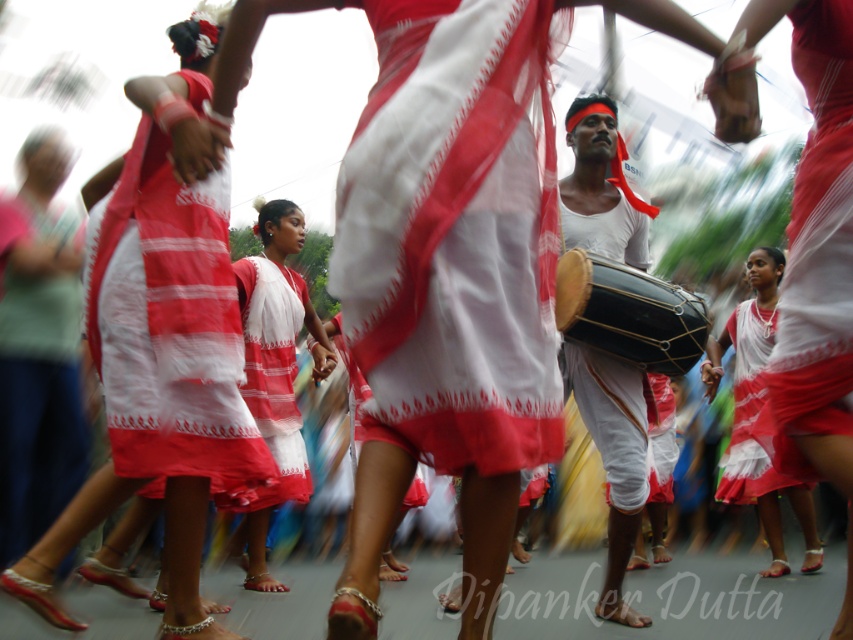
Question: Which point appears farthest from the camera in this image?

Choices:
 (A) (44, 579)
 (B) (619, 339)
 (C) (252, 394)
 (D) (762, 284)

Answer: (D)

Question: Observing the image, what is the correct spatial positioning of white woven dress at center in reference to white cotton saree at lower right?

Choices:
 (A) left
 (B) right

Answer: (A)

Question: Which object appears farthest from the camera in this image?

Choices:
 (A) white matte drum at center
 (B) white cotton saree at lower right
 (C) white woven dress at center
 (D) matte white dress at center

Answer: (B)

Question: Is white matte drum at center behind white woven dress at center?

Choices:
 (A) yes
 (B) no

Answer: (B)

Question: Is red and white striped fabric dress at center behind white cotton saree at lower right?

Choices:
 (A) yes
 (B) no

Answer: (B)

Question: Which of the following is the closest to the observer?

Choices:
 (A) (312, 374)
 (B) (228, 400)
 (C) (154, 397)

Answer: (C)